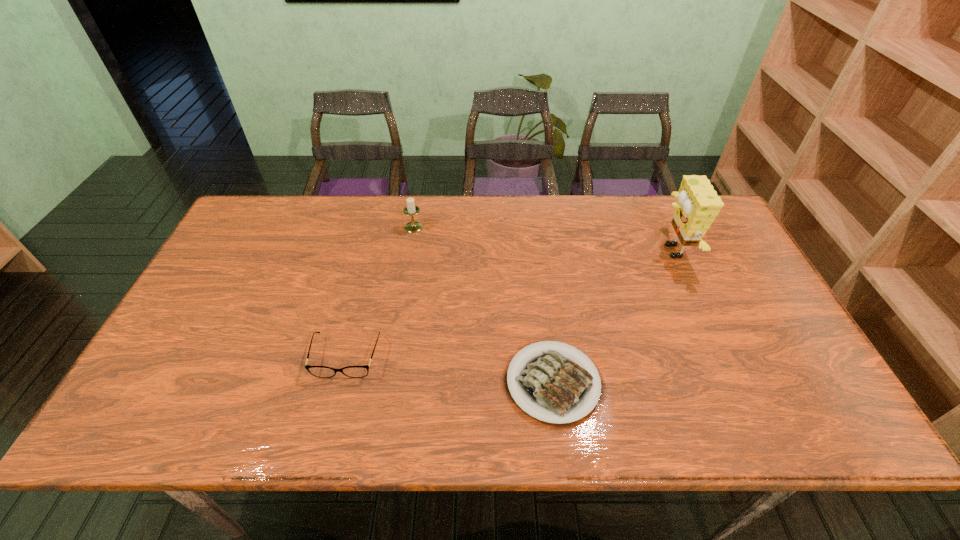
I want to click on vacant space positioned on the front-facing side of the sponge, so click(588, 251).

This screenshot has width=960, height=540. What are the coordinates of `free region located on the front of the candle holder` in the screenshot? It's located at (405, 281).

This screenshot has width=960, height=540. Identify the location of free region located 0.120m on the front-facing side of the spectacles. (329, 427).

You are a GUI agent. You are given a task and a screenshot of the screen. Output one action in this format:
    pyautogui.click(x=<x>, y=<y>)
    Task: Click on the vacant position located on the back of the shortest object
    
    Given the screenshot: What is the action you would take?
    pyautogui.click(x=540, y=281)

At what (x,y) coordinates should I click in order to perform the action: click on sponge that is at the far edge. Please return your answer as a coordinate pair (x, y). Looking at the image, I should click on (697, 206).

This screenshot has height=540, width=960. I want to click on candle holder present at the far edge, so click(411, 209).

Where is `object that is at the near edge`? object that is at the near edge is located at coordinates (553, 385).

Where is `object that is positioned at the right edge`? object that is positioned at the right edge is located at coordinates (697, 206).

Where is `object located at the far right corner`? object located at the far right corner is located at coordinates (697, 206).

Locate an element on the screen. The image size is (960, 540). vacant space at the far edge is located at coordinates (592, 231).